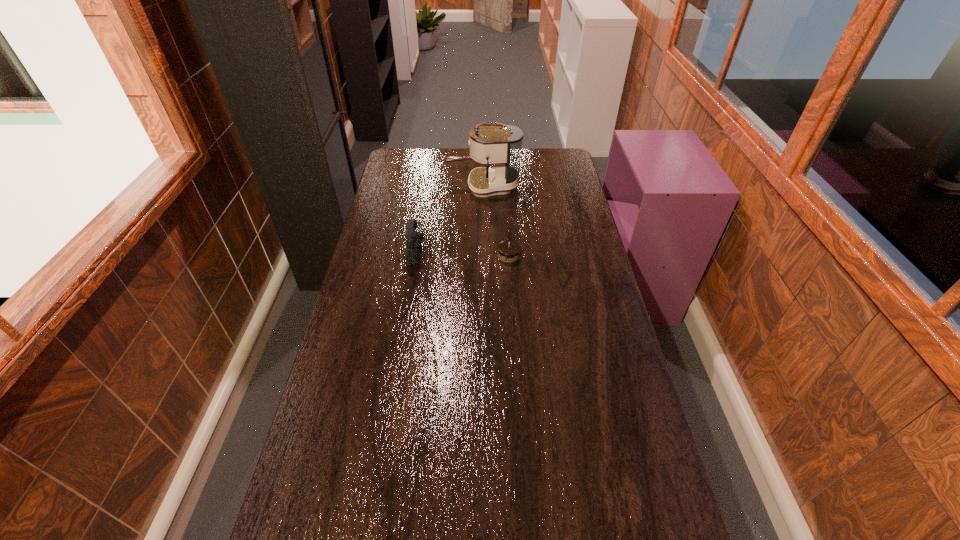
At what (x,y) coordinates should I click in order to perform the action: click on object at the left edge. Please return your answer as a coordinate pair (x, y). Image resolution: width=960 pixels, height=540 pixels. Looking at the image, I should click on (413, 239).

Find the location of `vacant point at the far edge`. vacant point at the far edge is located at coordinates (440, 151).

I want to click on vacant point at the left edge, so click(356, 478).

You are a GUI agent. You are given a task and a screenshot of the screen. Output one action in this format:
    pyautogui.click(x=<x>, y=<y>)
    Task: Click on the vacant space at the right edge
    This screenshot has width=960, height=540.
    Given the screenshot: What is the action you would take?
    pyautogui.click(x=597, y=383)

In the image, there is a desktop. Where is `blank space at the far right corner`? The image size is (960, 540). blank space at the far right corner is located at coordinates (555, 151).

Image resolution: width=960 pixels, height=540 pixels. What are the coordinates of `free spot between the headset and the coffee maker` in the screenshot? It's located at (449, 220).

This screenshot has height=540, width=960. What are the coordinates of `object that stands as the closest to the shortest object` in the screenshot? It's located at (413, 239).

Select which object is the second closest to the chocolate cake. Please provide its 2D coordinates. Your answer should be formatted as a tuple, i.e. [(x, y)], where the tuple contains the x and y coordinates of a point satisfying the conditions above.

[(501, 145)]

Where is `free space that satisfies the following two spatial constraints: 1. on the headband of the second shortest object; 2. on the left side of the chocolate cake`? The image size is (960, 540). free space that satisfies the following two spatial constraints: 1. on the headband of the second shortest object; 2. on the left side of the chocolate cake is located at coordinates (415, 255).

The width and height of the screenshot is (960, 540). Identify the location of free location that satisfies the following two spatial constraints: 1. on the headband of the leftmost object; 2. on the back side of the shortest object. (x=415, y=255).